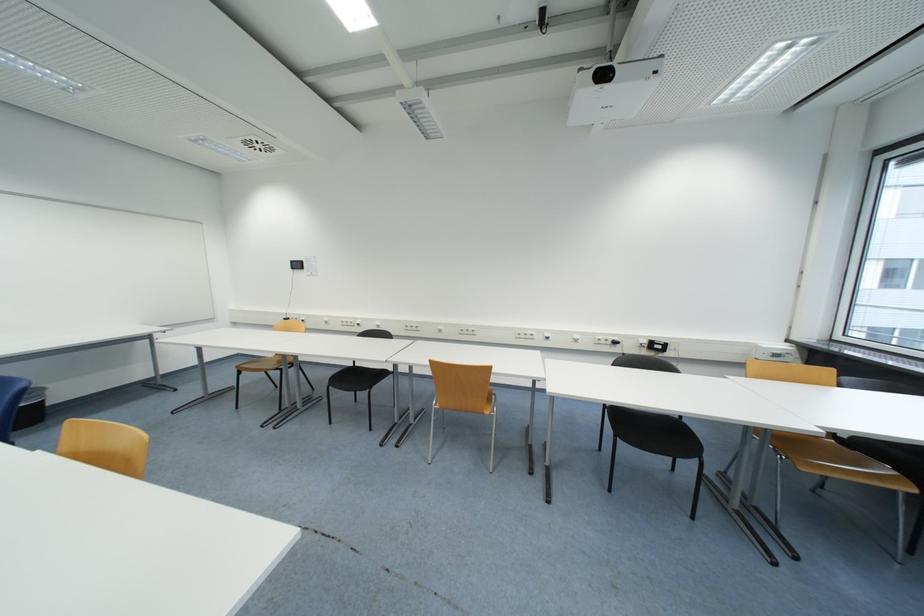
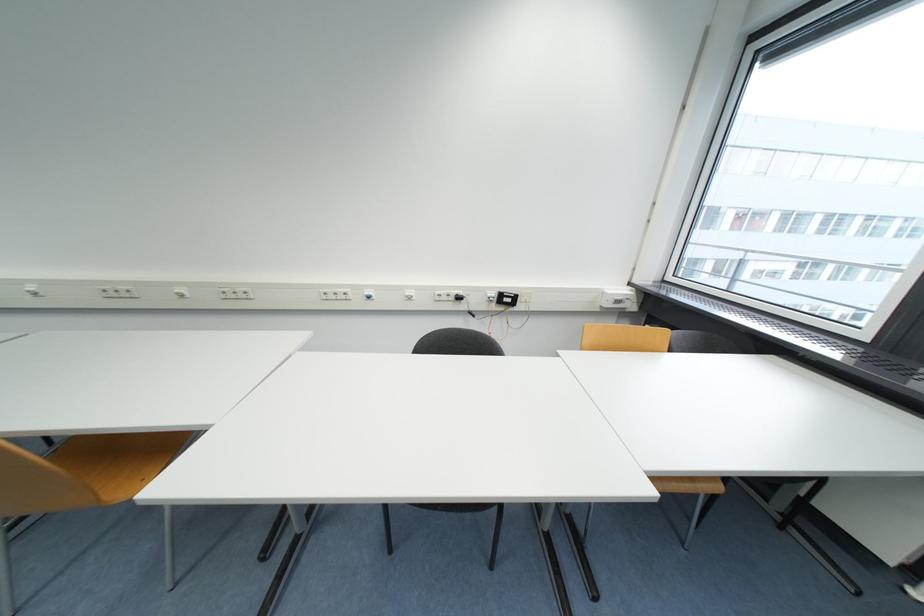
Based on the photo, the images are taken continuously from a first-person perspective. In which direction are you moving?

The cameraman walked toward right, forward.